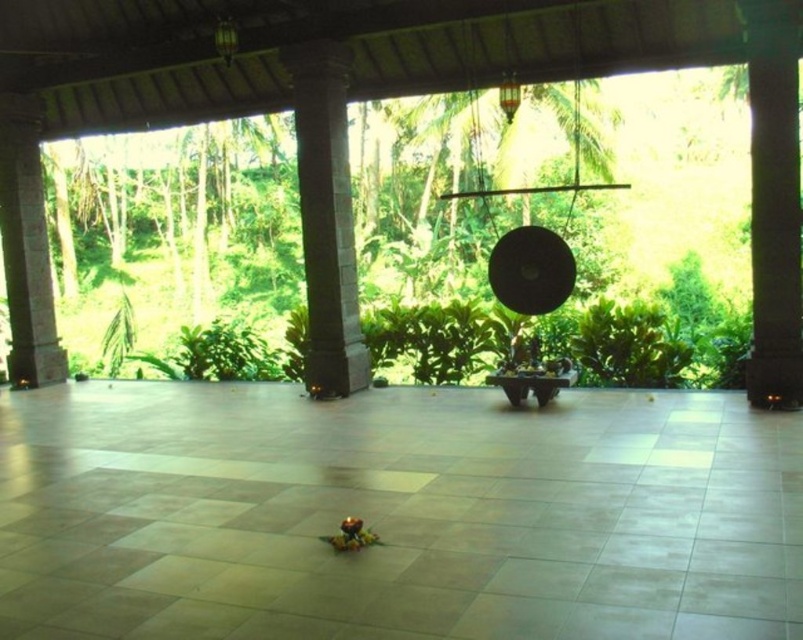
Locate an element on the screen. The image size is (803, 640). gray stone pillar at center is located at coordinates (325, 218).

Is gray stone pillar at center further to the viewer compared to brown stone pillar at left?

No, it is in front of brown stone pillar at left.

The width and height of the screenshot is (803, 640). What do you see at coordinates (325, 218) in the screenshot?
I see `gray stone pillar at center` at bounding box center [325, 218].

Find the location of a particular element. The height and width of the screenshot is (640, 803). gray stone pillar at center is located at coordinates (325, 218).

Does dark gray stone pillar at right come behind gray stone pillar at center?

No, dark gray stone pillar at right is closer to the viewer.

Who is more distant from viewer, [777,44] or [304,74]?

Point [304,74]

Where is `dark gray stone pillar at right`? This screenshot has height=640, width=803. dark gray stone pillar at right is located at coordinates (773, 202).

The width and height of the screenshot is (803, 640). Describe the element at coordinates (773, 202) in the screenshot. I see `dark gray stone pillar at right` at that location.

Is dark gray stone pillar at right smaller than brown stone pillar at left?

Correct, dark gray stone pillar at right occupies less space than brown stone pillar at left.

Image resolution: width=803 pixels, height=640 pixels. I want to click on dark gray stone pillar at right, so point(773,202).

Identify the location of dark gray stone pillar at right. Image resolution: width=803 pixels, height=640 pixels. (773, 202).